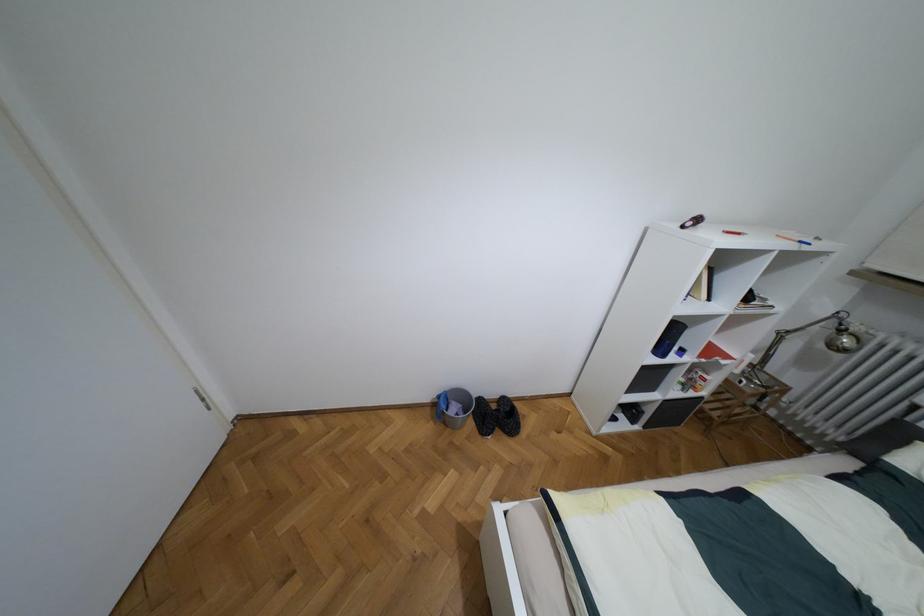
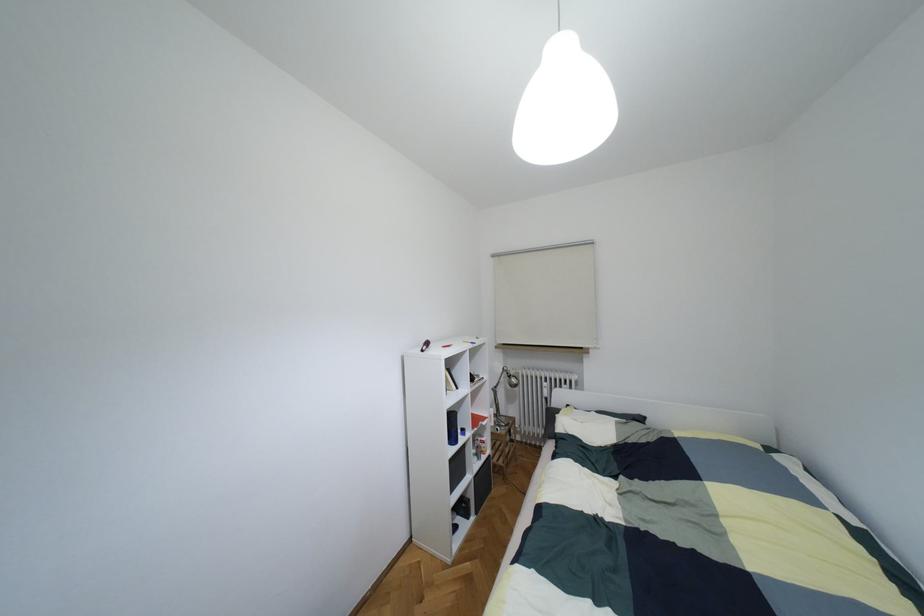
The point at (840, 330) is marked in the first image. Where is the corresponding point in the second image?

(508, 376)